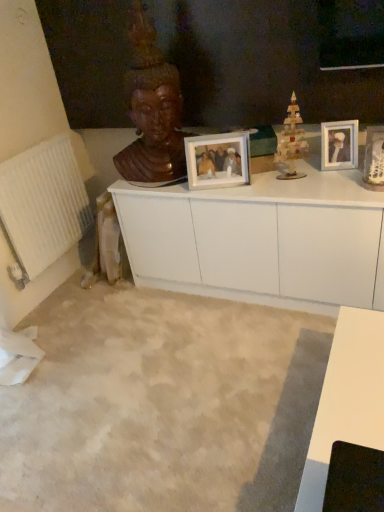
Question: Considering the relative sizes of wooden toy at center and white textured radiator at left in the image provided, is wooden toy at center bigger than white textured radiator at left?

Choices:
 (A) yes
 (B) no

Answer: (B)

Question: Is wooden toy at center next to white textured radiator at left?

Choices:
 (A) yes
 (B) no

Answer: (B)

Question: From a real-world perspective, is wooden toy at center located beneath white textured radiator at left?

Choices:
 (A) yes
 (B) no

Answer: (B)

Question: Is white textured radiator at left a part of wooden toy at center?

Choices:
 (A) yes
 (B) no

Answer: (B)

Question: Is wooden toy at center to the right of white textured radiator at left from the viewer's perspective?

Choices:
 (A) no
 (B) yes

Answer: (B)

Question: From the image's perspective, is wooden toy at center located beneath white textured radiator at left?

Choices:
 (A) yes
 (B) no

Answer: (B)

Question: From a real-world perspective, is matte white picture frame at center, the 2th picture frame in the right-to-left sequence, positioned over white glossy picture frame at upper right, the 2th picture frame from the left, based on gravity?

Choices:
 (A) no
 (B) yes

Answer: (B)

Question: Considering the relative sizes of matte white picture frame at center, the 2th picture frame in the right-to-left sequence, and white glossy picture frame at upper right, the 1th picture frame from the right, in the image provided, is matte white picture frame at center, the 2th picture frame in the right-to-left sequence, shorter than white glossy picture frame at upper right, the 1th picture frame from the right,?

Choices:
 (A) no
 (B) yes

Answer: (A)

Question: Can you confirm if matte white picture frame at center, which is the 1th picture frame from left to right, is bigger than white glossy picture frame at upper right, the 2th picture frame from the left?

Choices:
 (A) no
 (B) yes

Answer: (B)

Question: Is matte white picture frame at center, the 2th picture frame in the right-to-left sequence, oriented towards white glossy picture frame at upper right, the 2th picture frame from the left?

Choices:
 (A) no
 (B) yes

Answer: (A)

Question: From the image's perspective, is matte white picture frame at center, the 2th picture frame in the right-to-left sequence, on white glossy picture frame at upper right, the 2th picture frame from the left?

Choices:
 (A) no
 (B) yes

Answer: (A)

Question: Is matte white picture frame at center, which is the 1th picture frame from left to right, outside of white glossy picture frame at upper right, the 1th picture frame from the right?

Choices:
 (A) yes
 (B) no

Answer: (A)

Question: Is wooden toy at center located outside wooden statue at upper center?

Choices:
 (A) yes
 (B) no

Answer: (A)